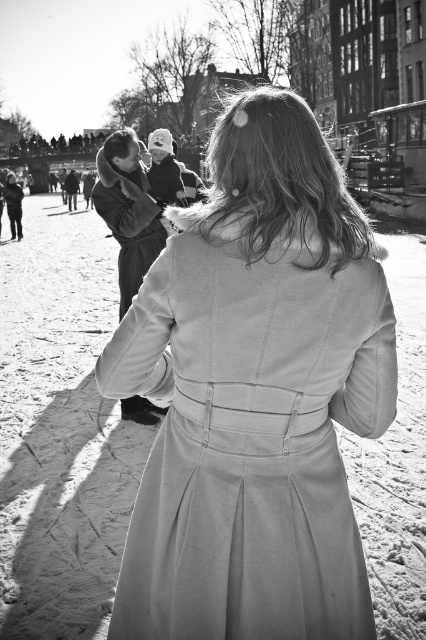
Question: Is satin-like white dress at center closer to camera compared to smooth beige trench coat at center?

Choices:
 (A) no
 (B) yes

Answer: (B)

Question: Is satin-like white dress at center positioned before smooth beige trench coat at center?

Choices:
 (A) yes
 (B) no

Answer: (A)

Question: Among these points, which one is farthest from the camera?

Choices:
 (A) (106, 140)
 (B) (270, 380)

Answer: (A)

Question: Does satin-like white dress at center come behind smooth beige trench coat at center?

Choices:
 (A) yes
 (B) no

Answer: (B)

Question: Which point is farther to the camera?

Choices:
 (A) (129, 141)
 (B) (345, 595)

Answer: (A)